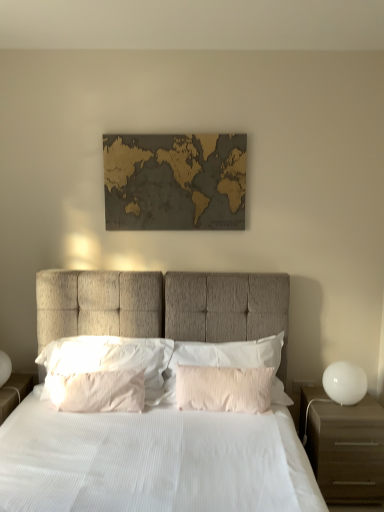
Question: Is white soft pillow at center, the 4th pillow in the right-to-left sequence, to the left of white fabric bed at center from the viewer's perspective?

Choices:
 (A) yes
 (B) no

Answer: (A)

Question: Is white soft pillow at center, the 4th pillow in the right-to-left sequence, aimed at white fabric bed at center?

Choices:
 (A) yes
 (B) no

Answer: (A)

Question: Is white soft pillow at center, the 4th pillow in the right-to-left sequence, turned away from white fabric bed at center?

Choices:
 (A) no
 (B) yes

Answer: (B)

Question: Are white soft pillow at center, which is the 1th pillow in left-to-right order, and white fabric bed at center beside each other?

Choices:
 (A) yes
 (B) no

Answer: (B)

Question: Does white soft pillow at center, which is the 1th pillow in left-to-right order, come in front of white fabric bed at center?

Choices:
 (A) no
 (B) yes

Answer: (A)

Question: Is wooden map at center inside the boundaries of pink textured pillow at center, the first pillow positioned from the right, or outside?

Choices:
 (A) outside
 (B) inside

Answer: (A)

Question: Is wooden map at center taller or shorter than pink textured pillow at center, marked as the 4th pillow in a left-to-right arrangement?

Choices:
 (A) tall
 (B) short

Answer: (A)

Question: Would you say wooden map at center is to the left or to the right of pink textured pillow at center, marked as the 4th pillow in a left-to-right arrangement, in the picture?

Choices:
 (A) left
 (B) right

Answer: (A)

Question: Based on their sizes in the image, would you say wooden map at center is bigger or smaller than pink textured pillow at center, the first pillow positioned from the right?

Choices:
 (A) small
 (B) big

Answer: (A)

Question: From the image's perspective, is white glossy sphere at right located above or below pearly white satin pillow at center, the second pillow viewed from the right?

Choices:
 (A) above
 (B) below

Answer: (A)

Question: Looking at the image, does white glossy sphere at right seem bigger or smaller compared to pearly white satin pillow at center, the second pillow viewed from the right?

Choices:
 (A) small
 (B) big

Answer: (A)

Question: Considering their positions, is white glossy sphere at right located in front of or behind pearly white satin pillow at center, arranged as the 3th pillow when viewed from the left?

Choices:
 (A) behind
 (B) front

Answer: (A)

Question: Considering the positions of white glossy sphere at right and pearly white satin pillow at center, the second pillow viewed from the right, in the image, is white glossy sphere at right wider or thinner than pearly white satin pillow at center, the second pillow viewed from the right,?

Choices:
 (A) wide
 (B) thin

Answer: (A)

Question: From the image's perspective, is pink textured pillow at center, positioned as the 2th pillow in left-to-right order, positioned above or below brown matte nightstand at right?

Choices:
 (A) below
 (B) above

Answer: (B)

Question: Considering the positions of pink textured pillow at center, positioned as the 2th pillow in left-to-right order, and brown matte nightstand at right in the image, is pink textured pillow at center, positioned as the 2th pillow in left-to-right order, bigger or smaller than brown matte nightstand at right?

Choices:
 (A) big
 (B) small

Answer: (B)